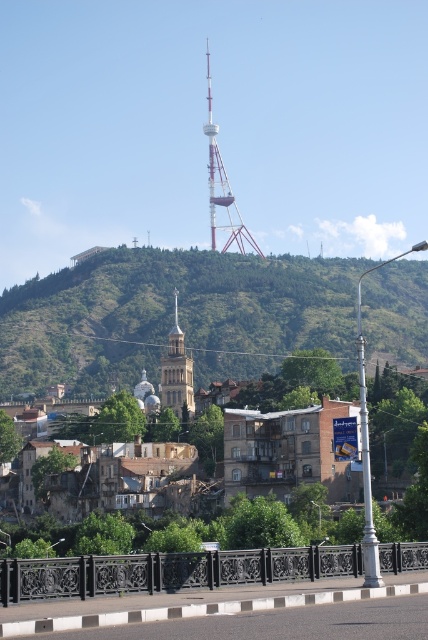
You are a city planner analyzing the layout of this area. The metallic lattice tower at center is crucial for communication. To ensure optimal signal coverage, you need to place a new antenna on the tower. Given the tower is at coordinates point 0.292, 0.519, where should the antenna be placed relative to the tower?

The antenna should be placed at the top of the metallic lattice tower at center since it is the highest point, which would provide the best signal coverage.

You are a photographer wanting to capture the golden stone church at center and the metallic lattice tower at center in a single shot. However, you can only position yourself so that one of the objects is fully visible while the other might be partially hidden. Based on their positions, which object will be fully visible and which might be partially obscured?

The golden stone church at center is behind the metallic lattice tower at center, so the metallic lattice tower at center will be fully visible, while the golden stone church at center might be partially obscured.

You are standing at the point marked as point (172,316) in the cityscape image. What can you see directly in front of you?

At point (172,316) lies green leafy hillside at upper center, so you can see the green leafy hillside at upper center directly in front of you.